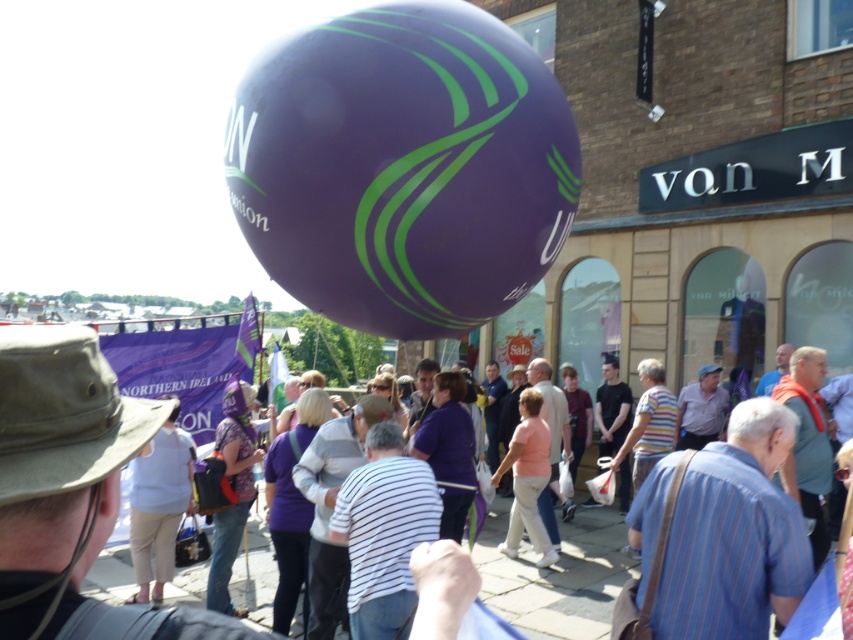
Can you confirm if purple glossy balloon at center is thinner than purple fabric crowd at center?

Yes, purple glossy balloon at center is thinner than purple fabric crowd at center.

Who is positioned more to the right, purple glossy balloon at center or purple fabric crowd at center?

From the viewer's perspective, purple glossy balloon at center appears more on the right side.

Where is `purple glossy balloon at center`? purple glossy balloon at center is located at coordinates (403, 168).

Who is lower down, purple glossy balloon at center or light blue cotton shirt at center?

light blue cotton shirt at center

Can you confirm if purple glossy balloon at center is bigger than light blue cotton shirt at center?

Incorrect, purple glossy balloon at center is not larger than light blue cotton shirt at center.

Who is more distant from viewer, [396,118] or [132,540]?

Point [132,540]

At what (x,y) coordinates should I click in order to perform the action: click on purple glossy balloon at center. Please return your answer as a coordinate pair (x, y). Looking at the image, I should click on (403, 168).

Does point (236, 636) come in front of point (163, 566)?

Yes, it is in front of point (163, 566).

Can you confirm if purple fabric crowd at center is positioned above light blue cotton shirt at center?

Actually, purple fabric crowd at center is below light blue cotton shirt at center.

The image size is (853, 640). Find the location of `purple fabric crowd at center`. purple fabric crowd at center is located at coordinates (65, 396).